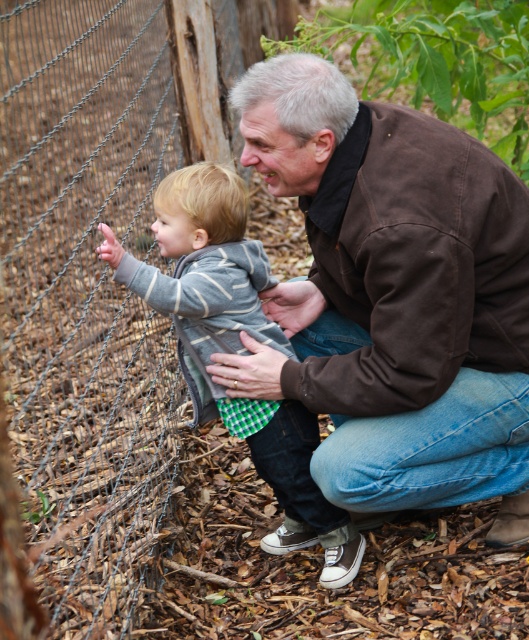
You are a photographer trying to capture a candid shot of the striped cotton sweater at center and the wire mesh fence at left. Since you want both subjects to be in focus, which one should you focus on first to ensure proper depth of field?

You should focus on the striped cotton sweater at center first because it is behind the wire mesh fence at left, so focusing on the farther object ensures the closer one will also be in focus.

What is the spatial relationship between the brown leather jacket at center and the wire mesh fence in the image?

The brown leather jacket at center is positioned closer to the viewer than the wire mesh fence, as the fence is behind the man and child.